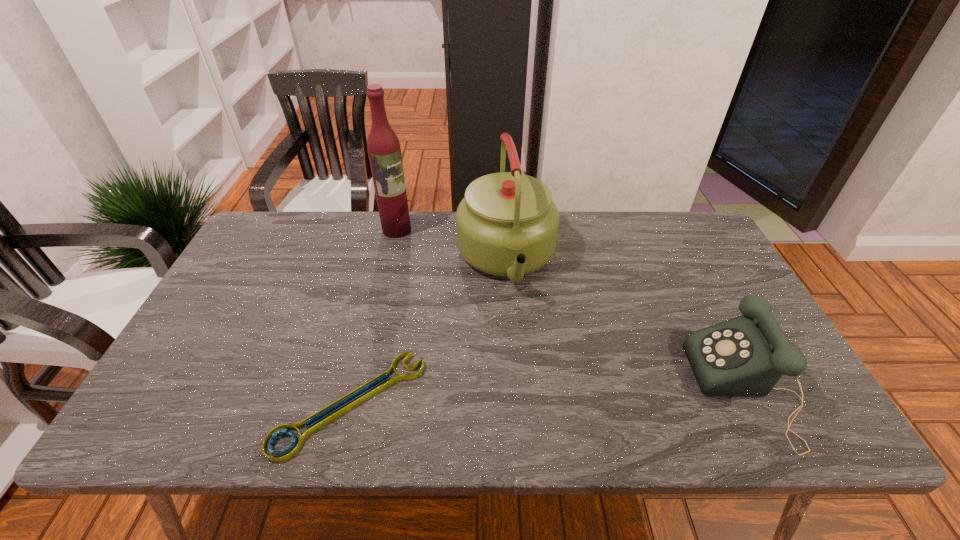
You are a GUI agent. You are given a task and a screenshot of the screen. Output one action in this format:
    pyautogui.click(x=<x>, y=<y>)
    Task: Click on the vacant area situated at the spout of the second object from right to left
    
    Given the screenshot: What is the action you would take?
    pyautogui.click(x=526, y=357)

Where is `free space located at the spout of the second object from right to left`? free space located at the spout of the second object from right to left is located at coordinates (533, 386).

At what (x,y) coordinates should I click in order to perform the action: click on vacant area located 0.110m at the spout of the second object from right to left. Please return your answer as a coordinate pair (x, y). This screenshot has width=960, height=540. Looking at the image, I should click on (522, 338).

You are a GUI agent. You are given a task and a screenshot of the screen. Output one action in this format:
    pyautogui.click(x=<x>, y=<y>)
    Task: Click on the vacant area situated on the label of the tallest object
    This screenshot has width=960, height=540.
    Given the screenshot: What is the action you would take?
    pyautogui.click(x=449, y=313)

Identify the location of free space located on the label of the tallest object. (452, 318).

In order to click on free spot located on the label of the tallest object in this screenshot , I will do `click(407, 246)`.

Find the location of `kettle that is at the far edge`. kettle that is at the far edge is located at coordinates (507, 225).

Find the location of a particular element. Image resolution: width=960 pixels, height=540 pixels. liquor at the far edge is located at coordinates (384, 151).

At what (x,y) coordinates should I click in order to perform the action: click on wrench that is positioned at the near edge. Please return your answer as a coordinate pair (x, y). The image size is (960, 540). Looking at the image, I should click on (285, 454).

You are a GUI agent. You are given a task and a screenshot of the screen. Output one action in this format:
    pyautogui.click(x=<x>, y=<y>)
    Task: Click on the telephone that is at the near edge
    The height and width of the screenshot is (540, 960).
    Given the screenshot: What is the action you would take?
    click(x=747, y=355)